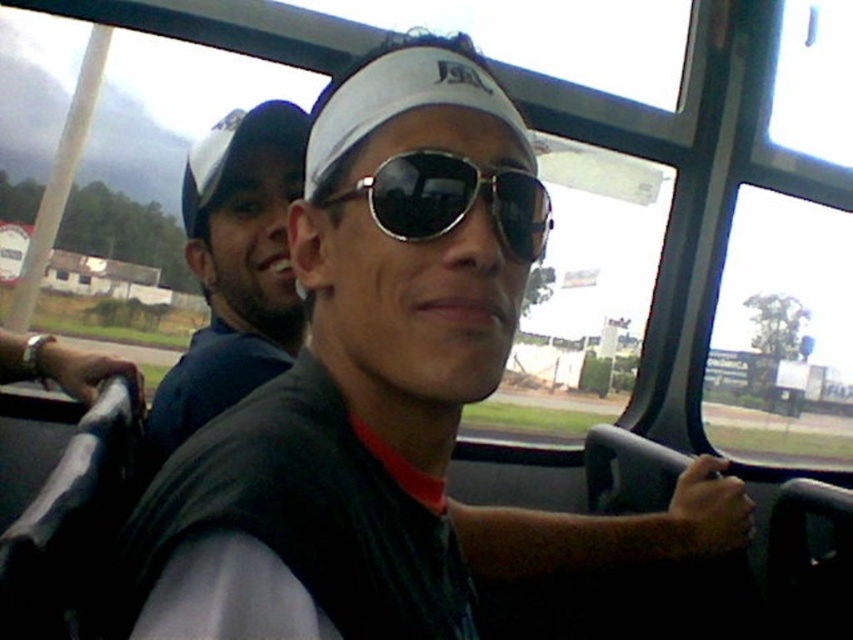
Can you confirm if blue fabric cap at upper left is positioned above sunglasses at center?

Indeed, blue fabric cap at upper left is positioned over sunglasses at center.

Is blue fabric cap at upper left to the left of sunglasses at center from the viewer's perspective?

Indeed, blue fabric cap at upper left is positioned on the left side of sunglasses at center.

Describe the element at coordinates (234, 269) in the screenshot. I see `blue fabric cap at upper left` at that location.

Identify the location of blue fabric cap at upper left. The image size is (853, 640). (234, 269).